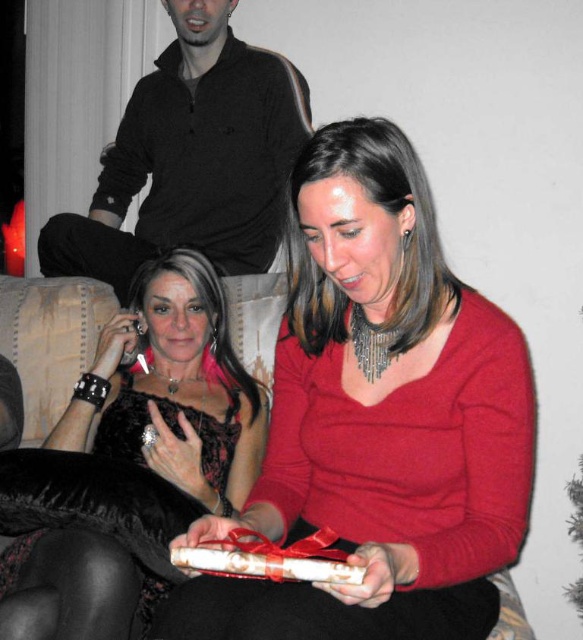
Is velvet black dress at left wider than black matte shirt at upper center?

Incorrect, velvet black dress at left's width does not surpass black matte shirt at upper center's.

Does velvet black dress at left lie in front of black matte shirt at upper center?

Yes, velvet black dress at left is in front of black matte shirt at upper center.

Does point (36, 500) lie in front of point (286, 90)?

That is True.

You are a GUI agent. You are given a task and a screenshot of the screen. Output one action in this format:
    pyautogui.click(x=<x>, y=<y>)
    Task: Click on the velvet black dress at left
    This screenshot has height=640, width=583.
    Given the screenshot: What is the action you would take?
    pyautogui.click(x=149, y=426)

How distant is matte red sweater at center from white paper gift at center?

They are 8.30 inches apart.

Is matte red sweater at center behind white paper gift at center?

That is True.

Where is `matte red sweater at center`? The width and height of the screenshot is (583, 640). matte red sweater at center is located at coordinates (378, 419).

Which of these two, matte red sweater at center or velvet black dress at left, stands taller?

matte red sweater at center is taller.

Is matte red sweater at center further to the viewer compared to velvet black dress at left?

No, matte red sweater at center is in front of velvet black dress at left.

Find the location of a particular element. The height and width of the screenshot is (640, 583). matte red sweater at center is located at coordinates (378, 419).

At what (x,y) coordinates should I click in order to perform the action: click on matte red sweater at center. Please return your answer as a coordinate pair (x, y). The height and width of the screenshot is (640, 583). Looking at the image, I should click on (378, 419).